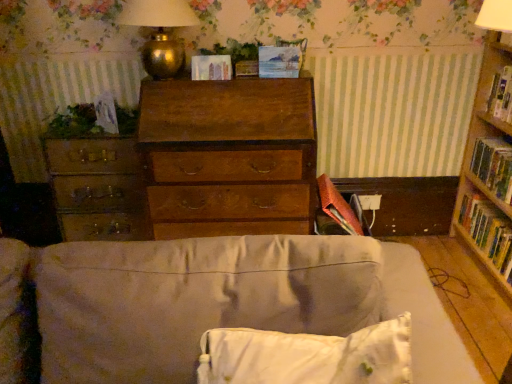
Image resolution: width=512 pixels, height=384 pixels. What do you see at coordinates (308, 356) in the screenshot?
I see `white soft pillow at lower center` at bounding box center [308, 356].

Measure the distance between white soft pillow at lower center and camera.

A distance of 27.38 inches exists between white soft pillow at lower center and camera.

Based on the photo, how much space does matte paper at center, positioned as the 3th paperback book in right-to-left order, occupy vertically?

matte paper at center, positioned as the 3th paperback book in right-to-left order, is 3.84 inches in height.

What is the approximate height of wooden file cabinet at left?

The height of wooden file cabinet at left is 13.62 inches.

This screenshot has width=512, height=384. What do you see at coordinates (493, 166) in the screenshot?
I see `hardcover book at right, which is the third paperback book in top-to-bottom order` at bounding box center [493, 166].

Where is `hardcover book at right, which is the third paperback book in top-to-bottom order`? hardcover book at right, which is the third paperback book in top-to-bottom order is located at coordinates (493, 166).

Where is `hardcover book at right`? hardcover book at right is located at coordinates (488, 232).

From the image's perspective, is matte paper at center, positioned as the 3th paperback book in right-to-left order, positioned above or below white soft pillow at lower center?

matte paper at center, positioned as the 3th paperback book in right-to-left order, is above white soft pillow at lower center.

Considering the sizes of objects matte paper at center, positioned as the 3th paperback book in right-to-left order, and white soft pillow at lower center in the image provided, who is bigger, matte paper at center, positioned as the 3th paperback book in right-to-left order, or white soft pillow at lower center?

white soft pillow at lower center.

Which object is positioned more to the right, matte paper at center, the second paperback book when ordered from top to bottom, or white soft pillow at lower center?

white soft pillow at lower center.

From the image's perspective, is pastel blue paper at center, the 2th paperback book in the right-to-left sequence, located beneath wooden chest of drawers at center?

Incorrect, from the image's perspective, pastel blue paper at center, the 2th paperback book in the right-to-left sequence, is higher than wooden chest of drawers at center.

Locate an element on the screen. The height and width of the screenshot is (384, 512). chest of drawers below the pastel blue paper at center, which ranks as the 3th paperback book in bottom-to-top order (from a real-world perspective) is located at coordinates (200, 161).

Is pastel blue paper at center, marked as the 2th paperback book in a left-to-right arrangement, facing away from wooden chest of drawers at center?

No, pastel blue paper at center, marked as the 2th paperback book in a left-to-right arrangement, is not facing away from wooden chest of drawers at center.

From the image's perspective, would you say hardcover book at right, which is the 1th paperback book from bottom to top, is positioned over matte paper at center, the second paperback book when ordered from top to bottom?

No, from the image's perspective, hardcover book at right, which is the 1th paperback book from bottom to top, is not on top of matte paper at center, the second paperback book when ordered from top to bottom.

Is hardcover book at right, positioned as the 1th paperback book in right-to-left order, turned away from matte paper at center, the second paperback book when ordered from top to bottom?

That's not correct — hardcover book at right, positioned as the 1th paperback book in right-to-left order, is not looking away from matte paper at center, the second paperback book when ordered from top to bottom.

Considering the relative positions of hardcover book at right, the third paperback book in the left-to-right sequence, and matte paper at center, positioned as the 3th paperback book in right-to-left order, in the image provided, is hardcover book at right, the third paperback book in the left-to-right sequence, to the right of matte paper at center, positioned as the 3th paperback book in right-to-left order, from the viewer's perspective?

Indeed, hardcover book at right, the third paperback book in the left-to-right sequence, is positioned on the right side of matte paper at center, positioned as the 3th paperback book in right-to-left order.

Is hardcover book at right, which is the 1th paperback book from bottom to top, inside the boundaries of matte paper at center, the first paperback book positioned from the left, or outside?

hardcover book at right, which is the 1th paperback book from bottom to top, cannot be found inside matte paper at center, the first paperback book positioned from the left.

Can you confirm if gold metallic table lamp at upper center is taller than green leafy plant at center, which is the 1th plant in top-to-bottom order?

Indeed, gold metallic table lamp at upper center has a greater height compared to green leafy plant at center, which is the 1th plant in top-to-bottom order.

Is point (148, 71) farther from viewer compared to point (234, 54)?

That is True.

From a real-world perspective, which object stands above the other?

gold metallic table lamp at upper center is physically above.

This screenshot has width=512, height=384. What are the coordinates of `table lamp that is in front of the green leafy plant at center, which is the 1th plant in top-to-bottom order` in the screenshot? It's located at (160, 33).

Is green leafy plant at center, the 2th plant viewed from the left, positioned far away from wooden file cabinet at left?

Actually, green leafy plant at center, the 2th plant viewed from the left, and wooden file cabinet at left are a little close together.

Who is smaller, green leafy plant at center, which is the 1th plant from right to left, or wooden file cabinet at left?

Smaller between the two is green leafy plant at center, which is the 1th plant from right to left.

From a real-world perspective, between green leafy plant at center, which is the 1th plant from right to left, and wooden file cabinet at left, who is vertically higher?

In real-world perspective, green leafy plant at center, which is the 1th plant from right to left, is above.

Looking at this image, who is shorter, green leafy plant at center, which is the 1th plant from right to left, or wooden file cabinet at left?

green leafy plant at center, which is the 1th plant from right to left, is shorter.

From a real-world perspective, is white soft pillow at lower center physically above green leafy plant at left, which is counted as the 1th plant, starting from the left?

Incorrect, from a real-world perspective, white soft pillow at lower center is lower than green leafy plant at left, which is counted as the 1th plant, starting from the left.

From the image's perspective, is white soft pillow at lower center on green leafy plant at left, which ranks as the first plant in bottom-to-top order?

No.

Is white soft pillow at lower center oriented towards green leafy plant at left, which is the second plant from top to bottom?

No, white soft pillow at lower center is not aimed at green leafy plant at left, which is the second plant from top to bottom.

Is green leafy plant at left, which is counted as the 1th plant, starting from the left, surrounded by white soft pillow at lower center?

Actually, green leafy plant at left, which is counted as the 1th plant, starting from the left, is outside white soft pillow at lower center.

Where is `table lamp that is on the left side of hardcover book at right, which is the third paperback book in top-to-bottom order`? This screenshot has width=512, height=384. table lamp that is on the left side of hardcover book at right, which is the third paperback book in top-to-bottom order is located at coordinates pyautogui.click(x=160, y=33).

Which of these two, hardcover book at right, which is the 1th paperback book from bottom to top, or gold metallic table lamp at upper center, is smaller?

Smaller between the two is hardcover book at right, which is the 1th paperback book from bottom to top.

Based on the photo, considering the positions of objects hardcover book at right, which is the third paperback book in top-to-bottom order, and gold metallic table lamp at upper center in the image provided, who is in front, hardcover book at right, which is the third paperback book in top-to-bottom order, or gold metallic table lamp at upper center?

Positioned in front is gold metallic table lamp at upper center.

From the image's perspective, is hardcover book at right, which is the third paperback book in top-to-bottom order, under gold metallic table lamp at upper center?

Yes.

Find the location of a particular element. The height and width of the screenshot is (384, 512). pillow in front of the matte paper at center, placed as the 2th paperback book when sorted from bottom to top is located at coordinates (308, 356).

Locate an element on the screen. chest of drawers on the left of pastel blue paper at center, which ranks as the 3th paperback book in bottom-to-top order is located at coordinates (200, 161).

From the picture: From the image, which object appears to be farther from gold metallic table lamp at upper center, green leafy plant at left, which ranks as the first plant in bottom-to-top order, or hardcover book at right, which is the third paperback book in top-to-bottom order?

hardcover book at right, which is the third paperback book in top-to-bottom order, is positioned further to the anchor gold metallic table lamp at upper center.

When comparing their distances from gold metallic table lamp at upper center, does pastel blue paper at center, marked as the 2th paperback book in a left-to-right arrangement, or wooden file cabinet at left seem closer?

pastel blue paper at center, marked as the 2th paperback book in a left-to-right arrangement, lies closer to gold metallic table lamp at upper center than the other object.

When comparing their distances from white soft pillow at lower center, does hardcover book at right or gold metallic table lamp at upper center seem further?

hardcover book at right.

Based on their spatial positions, is beige fabric couch at center or gold metallic table lamp at upper center further from white soft pillow at lower center?

gold metallic table lamp at upper center lies further to white soft pillow at lower center than the other object.

Considering their positions, is gold metallic table lamp at upper center positioned closer to green leafy plant at center, the 2th plant viewed from the left, than matte paper at center, the first paperback book positioned from the left?

matte paper at center, the first paperback book positioned from the left.

Considering their positions, is gold metallic table lamp at upper center positioned further to white soft pillow at lower center than wooden file cabinet at left?

gold metallic table lamp at upper center is further to white soft pillow at lower center.

Estimate the real-world distances between objects in this image. Which object is closer to gold metallic table lamp at upper center, white soft pillow at lower center or hardcover book at right?

white soft pillow at lower center.

Estimate the real-world distances between objects in this image. Which object is closer to hardcover book at right, pastel blue paper at center, marked as the first paperback book in a top-to-bottom arrangement, or hardcover book at right, the third paperback book in the left-to-right sequence?

Based on the image, hardcover book at right, the third paperback book in the left-to-right sequence, appears to be nearer to hardcover book at right.

Identify the location of table lamp between green leafy plant at left, which ranks as the first plant in bottom-to-top order, and green leafy plant at center, which is the 1th plant in top-to-bottom order. (160, 33).

This screenshot has height=384, width=512. What are the coordinates of `paperback book located between wooden file cabinet at left and green leafy plant at center, the 2th plant viewed from the left, in the left-right direction` in the screenshot? It's located at (211, 67).

Identify the location of table lamp located between white soft pillow at lower center and green leafy plant at left, which is counted as the 1th plant, starting from the left, in the depth direction. (160, 33).

At what (x,y) coordinates should I click in order to perform the action: click on table lamp situated between wooden file cabinet at left and matte paper at center, the first paperback book positioned from the left, from left to right. Please return your answer as a coordinate pair (x, y). Image resolution: width=512 pixels, height=384 pixels. Looking at the image, I should click on (160, 33).